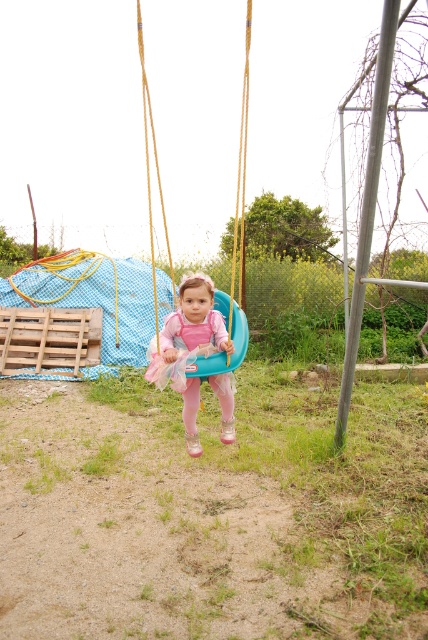
Question: Does pink tulle dress at center appear under teal plastic swing at center?

Choices:
 (A) yes
 (B) no

Answer: (A)

Question: Which of the following is the closest to the observer?

Choices:
 (A) pink tulle dress at center
 (B) teal plastic swing at center

Answer: (A)

Question: Which point is farther to the camera?

Choices:
 (A) teal plastic swing at center
 (B) pink tulle dress at center

Answer: (A)

Question: Can you confirm if pink tulle dress at center is thinner than teal plastic swing at center?

Choices:
 (A) no
 (B) yes

Answer: (B)

Question: Is pink tulle dress at center positioned before teal plastic swing at center?

Choices:
 (A) yes
 (B) no

Answer: (A)